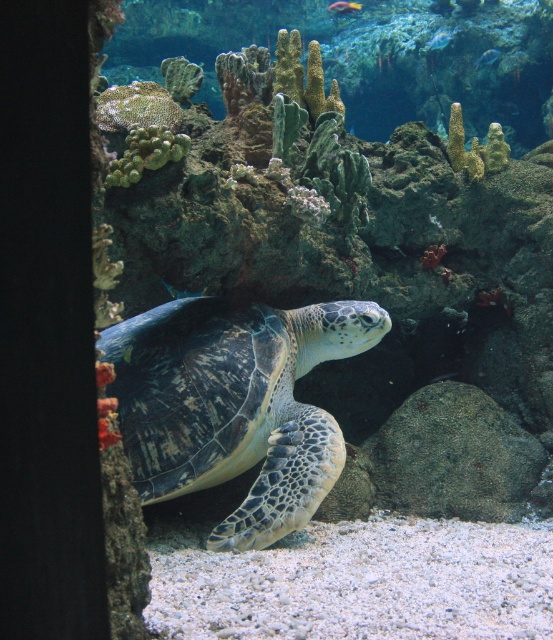
Can you confirm if leathery green turtle at center is wider than translucent blue fish at upper center?

Yes, leathery green turtle at center is wider than translucent blue fish at upper center.

Is leathery green turtle at center above translucent blue fish at upper center?

No, leathery green turtle at center is not above translucent blue fish at upper center.

Who is more distant from viewer, (247, 406) or (445, 42)?

Point (445, 42)

You are a GUI agent. You are given a task and a screenshot of the screen. Output one action in this format:
    pyautogui.click(x=<x>, y=<y>)
    Task: Click on the leathery green turtle at center
    The height and width of the screenshot is (640, 553).
    Given the screenshot: What is the action you would take?
    pyautogui.click(x=233, y=404)

Is gray rough rock at center-right wider than translucent blue fish at upper center?

Yes.

Which is in front, point (469, 408) or point (444, 40)?

Point (469, 408) is more forward.

I want to click on gray rough rock at center-right, so click(453, 456).

Which is below, leathery green turtle at center or shiny blue fish at upper center?

leathery green turtle at center is lower down.

Does leathery green turtle at center appear on the right side of shiny blue fish at upper center?

No, leathery green turtle at center is not to the right of shiny blue fish at upper center.

You are a GUI agent. You are given a task and a screenshot of the screen. Output one action in this format:
    pyautogui.click(x=<x>, y=<y>)
    Task: Click on the leathery green turtle at center
    The image size is (553, 640).
    Given the screenshot: What is the action you would take?
    pyautogui.click(x=233, y=404)